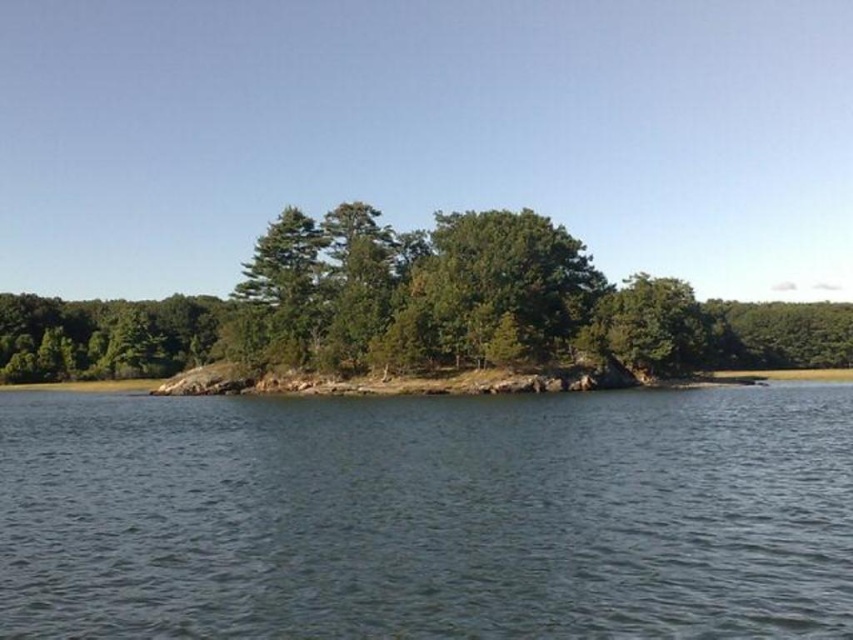
You are standing on the edge of the island and want to reach the clear water at center. Which direction should you move relative to the green leafy tree at center?

You should move to the left relative to the green leafy tree at center because the clear water at center is located to the left of the tree.

You are standing on the shore observing the clear water at center and the green leafy tree at center. Which object appears taller from your viewpoint?

The green leafy tree at center appears taller than the clear water at center because the clear water at center is shorter than the green leafy tree at center.

You are a boat captain navigating a small boat that is 5 meters long. You want to pass between the clear water at center and the green leafy tree at center. Can your boat fit through the space between them?

The distance between the clear water at center and the green leafy tree at center is 53.72 meters, so yes, the boat can fit through the space between them since it is much wider than the boat.